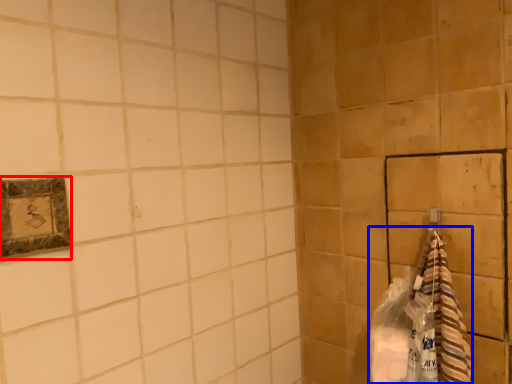
Question: Which of the following is the farthest to the observer, picture frame (highlighted by a red box) or material (highlighted by a blue box)?

Choices:
 (A) picture frame
 (B) material

Answer: (B)